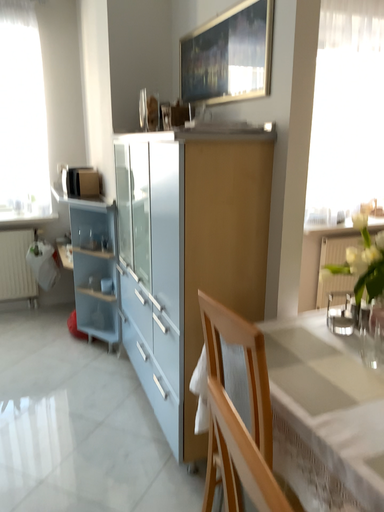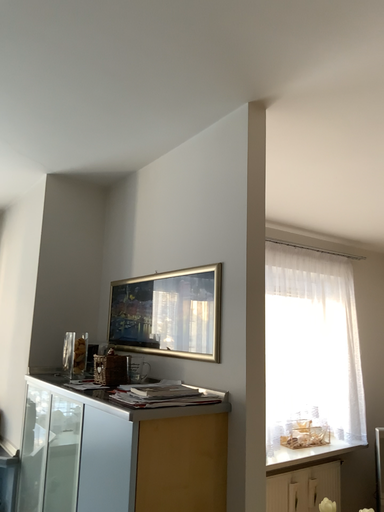
Question: Which way did the camera rotate in the video?

Choices:
 (A) rotated right
 (B) rotated left

Answer: (A)